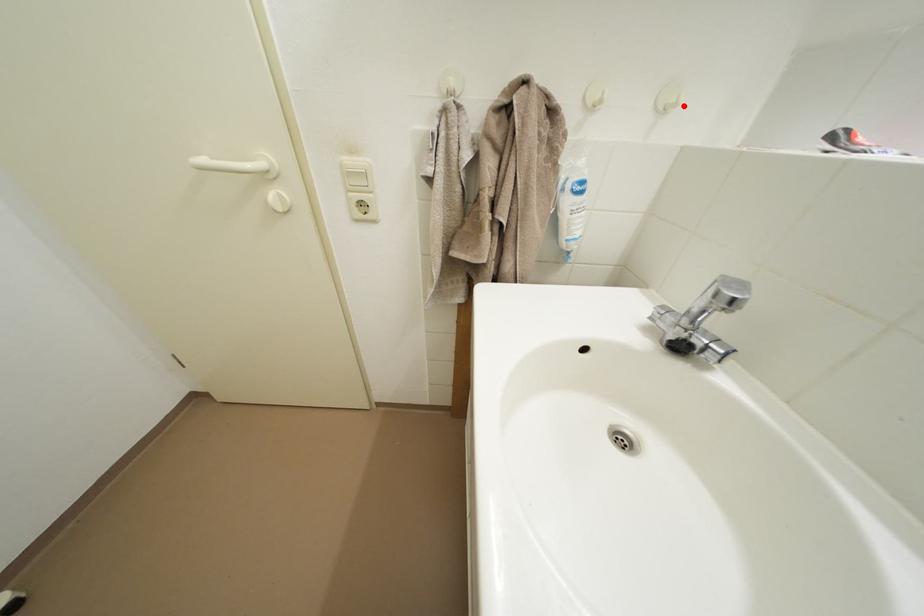
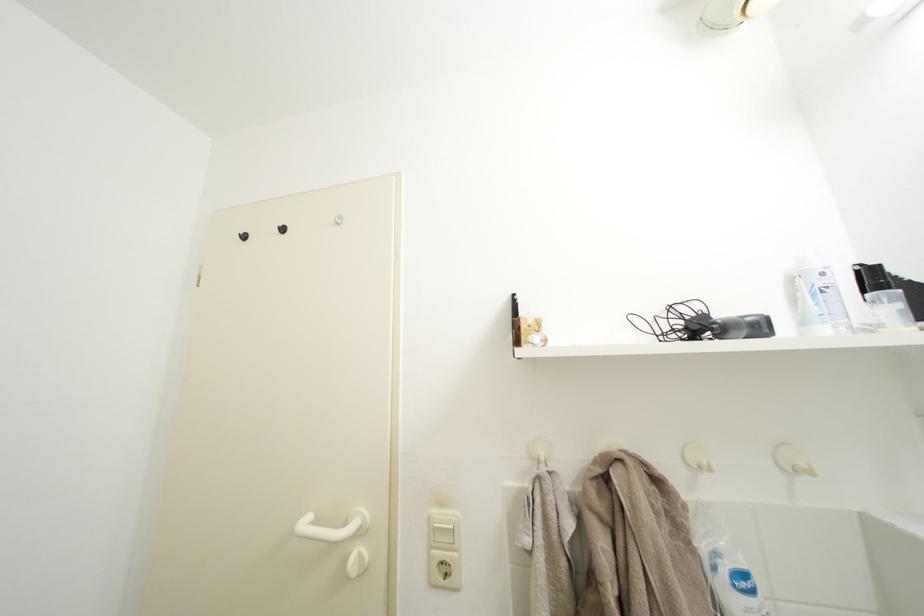
Locate, in the second image, the point that corresponds to the highlighted location in the first image.

(813, 471)